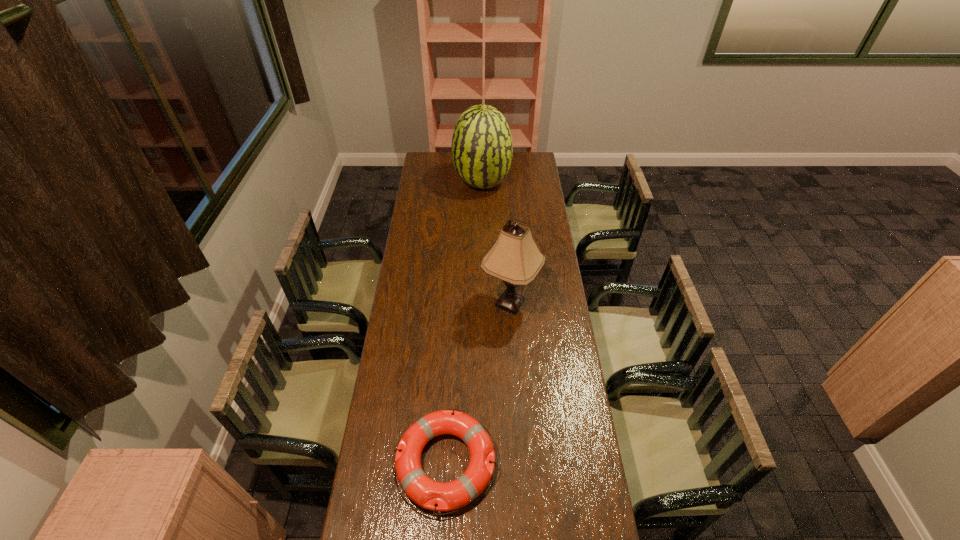
The image size is (960, 540). I want to click on vacant space that satisfies the following two spatial constraints: 1. on the back side of the nearest object; 2. on the right side of the watermelon, so click(x=461, y=184).